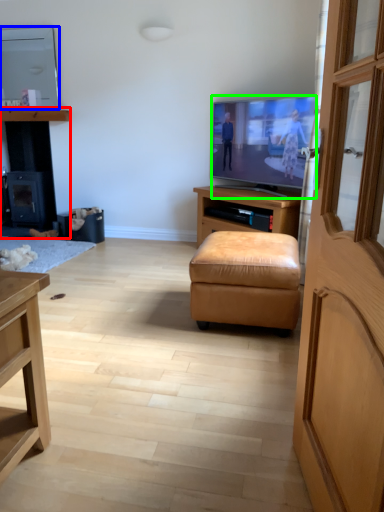
Question: Estimate the real-world distances between objects in this image. Which object is farther from dresser (highlighted by a red box), television (highlighted by a blue box) or television (highlighted by a green box)?

Choices:
 (A) television
 (B) television

Answer: (B)